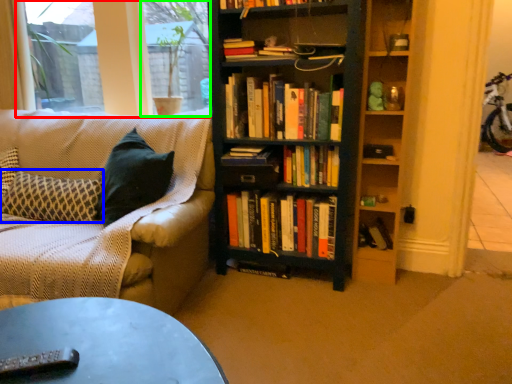
Question: Which object is positioned closest to window screen (highlighted by a red box)? Select from pillow (highlighted by a blue box) and window screen (highlighted by a green box).

Choices:
 (A) pillow
 (B) window screen

Answer: (B)